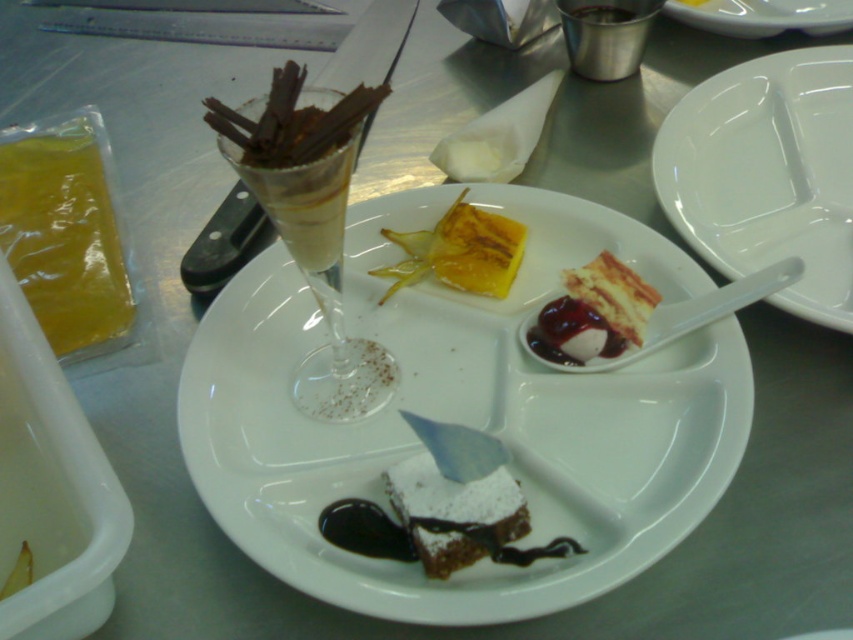
You are a food photographer setting up a shot. Your camera is positioned 12.40 inches away from the white matte plate at center. To ensure the entire plate is in focus, you need to know the plate diameter. Can you confirm if the plate is larger than 12 inches in diameter?

The white matte plate at center is positioned 12.40 inches away from the camera. Without knowing the plate diameter, it is impossible to determine if it is larger than 12 inches. Additional information about the plate size is required to answer this question.

You are a food stylist arranging desserts on a white segmented plate. You have a white matte plate at center and a powdered brownie at center. Which dessert is placed to the left of the other?

The white matte plate at center is positioned on the right side of powdered brownie at center, so the powdered brownie at center is to the left of the white matte plate at center.